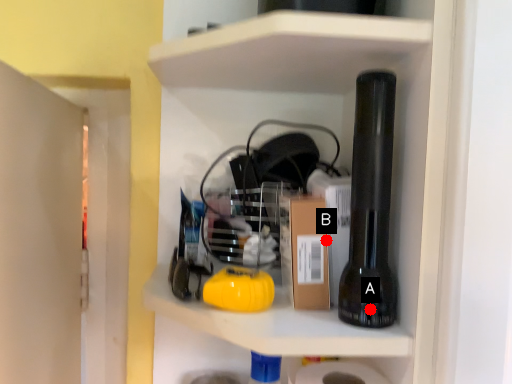
Question: Two points are circled on the image, labeled by A and B beside each circle. Which point is closer to the camera?

Choices:
 (A) A is closer
 (B) B is closer

Answer: (A)